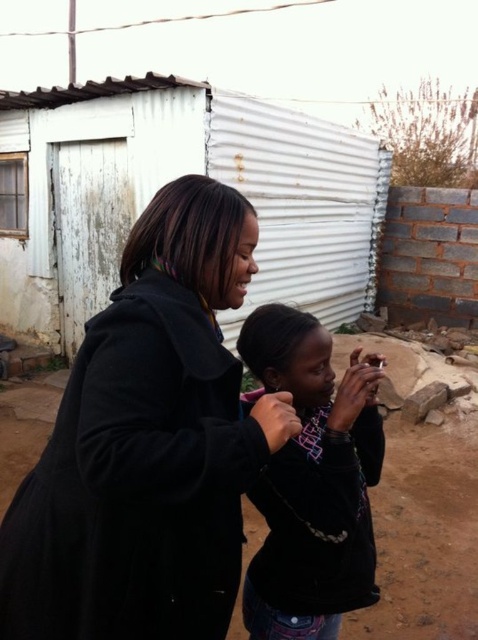
Which is more to the right, black fleece jacket at center or white corrugated metal hut at center?

From the viewer's perspective, white corrugated metal hut at center appears more on the right side.

Which is more to the left, black fleece jacket at center or white corrugated metal hut at center?

black fleece jacket at center is more to the left.

Which is in front, point (6, 525) or point (318, 284)?

Point (6, 525) is more forward.

This screenshot has height=640, width=478. I want to click on black fleece jacket at center, so click(148, 444).

Is black fleece jacket at center smaller than dark blue fleece jacket at center?

No.

Which is in front, point (213, 582) or point (341, 529)?

Point (213, 582) is in front.

The height and width of the screenshot is (640, 478). What are the coordinates of `black fleece jacket at center` in the screenshot? It's located at (148, 444).

Identify the location of black fleece jacket at center. This screenshot has height=640, width=478. (148, 444).

Can you confirm if black fleece jacket at center is wider than dirt field at lower center?

No.

Is black fleece jacket at center above dirt field at lower center?

Indeed, black fleece jacket at center is positioned over dirt field at lower center.

Who is more distant from viewer, (159, 244) or (400, 582)?

The point (400, 582) is more distant.

Find the location of a particular element. black fleece jacket at center is located at coordinates (148, 444).